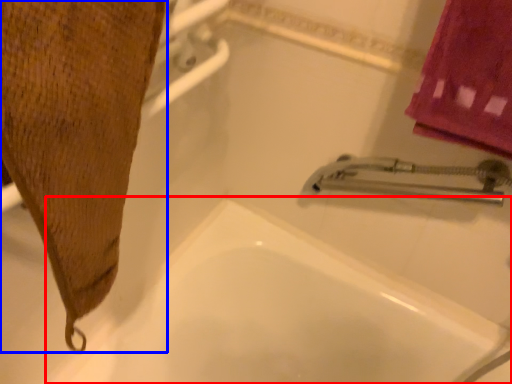
Question: Which point is closer to the camera, bath (highlighted by a red box) or bath towel (highlighted by a blue box)?

Choices:
 (A) bath
 (B) bath towel

Answer: (B)